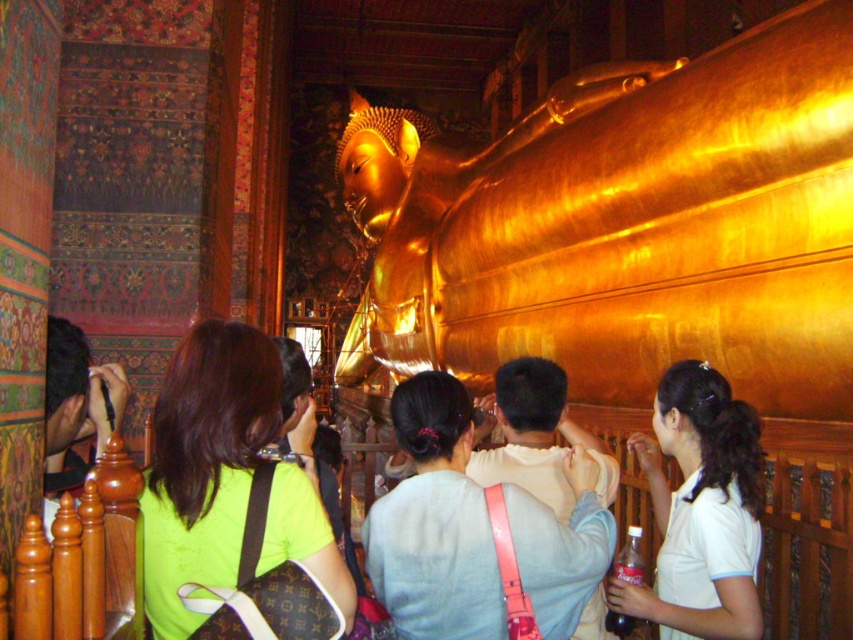
Question: Does green fabric bag at center appear under dark brown hair at left?

Choices:
 (A) yes
 (B) no

Answer: (A)

Question: Among these points, which one is farthest from the camera?

Choices:
 (A) (408, 506)
 (B) (207, 371)
 (C) (50, 401)
 (D) (676, 604)

Answer: (D)

Question: Among these points, which one is nearest to the camera?

Choices:
 (A) (206, 461)
 (B) (660, 438)

Answer: (A)

Question: Observing the image, what is the correct spatial positioning of light blue fabric shirt at center in reference to dark brown hair at left?

Choices:
 (A) below
 (B) above

Answer: (A)

Question: Can you confirm if white matte shirt at center is positioned above dark brown hair at left?

Choices:
 (A) no
 (B) yes

Answer: (A)

Question: Which object is positioned closest to the light blue fabric shirt at center?

Choices:
 (A) white matte shirt at center
 (B) dark brown hair at left

Answer: (A)